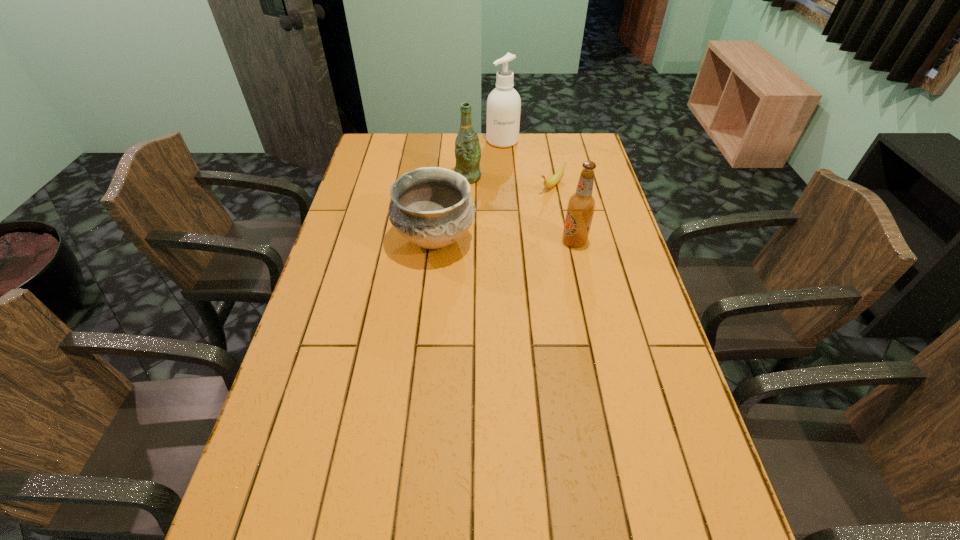
I want to click on the fourth tallest object, so click(x=431, y=207).

The height and width of the screenshot is (540, 960). Identify the location of the right beer bottle. (581, 205).

Locate an element on the screen. Image resolution: width=960 pixels, height=540 pixels. the left beer bottle is located at coordinates (467, 147).

Image resolution: width=960 pixels, height=540 pixels. In order to click on the third object from left to right in this screenshot , I will do `click(503, 104)`.

Where is `the farthest object`? The height and width of the screenshot is (540, 960). the farthest object is located at coordinates (503, 104).

Where is `the shortest object`? the shortest object is located at coordinates (556, 177).

Find the location of `vacant region located 0.060m on the front of the second shortest object`. vacant region located 0.060m on the front of the second shortest object is located at coordinates click(x=431, y=282).

The image size is (960, 540). Find the location of `vacant space located on the front label of the right beer bottle`. vacant space located on the front label of the right beer bottle is located at coordinates (485, 241).

The image size is (960, 540). I want to click on vacant space located on the front label of the right beer bottle, so click(x=545, y=241).

Identify the location of vacant space located 0.140m on the front label of the right beer bottle. The height and width of the screenshot is (540, 960). (516, 241).